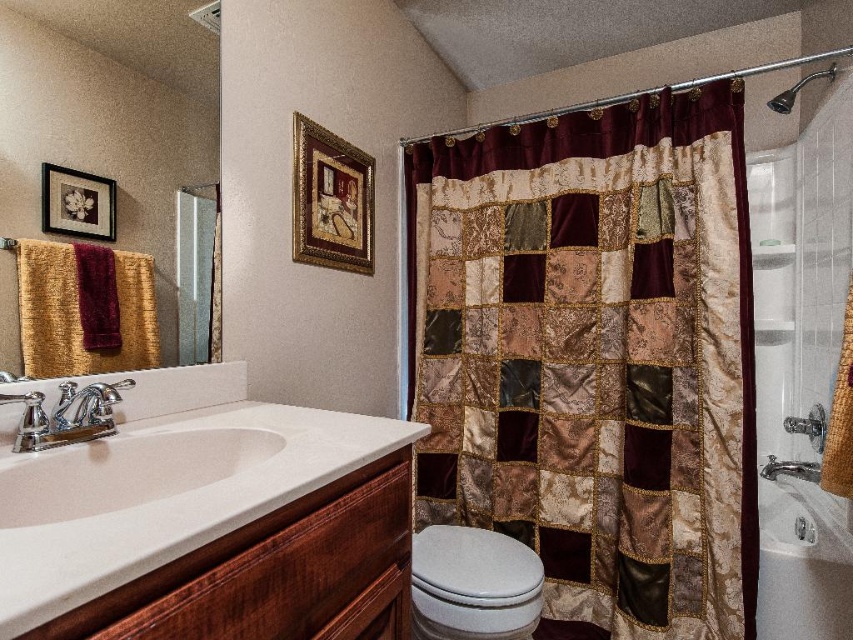
Question: Which object appears closest to the camera in this image?

Choices:
 (A) white ceramic bathtub at lower right
 (B) gold textured towel at left
 (C) white glossy sink at center
 (D) patchwork fabric shower curtain at center

Answer: (C)

Question: Does white ceramic bathtub at lower right appear on the left side of woven straw towel at right?

Choices:
 (A) no
 (B) yes

Answer: (A)

Question: Which point is farther to the camera?

Choices:
 (A) (183, 209)
 (B) (73, 396)
 (C) (183, 445)

Answer: (A)

Question: Can you confirm if white ceramic bathtub at lower right is smaller than metallic silver showerhead at upper right?

Choices:
 (A) yes
 (B) no

Answer: (B)

Question: Which object appears farthest from the camera in this image?

Choices:
 (A) white ceramic bathtub at lower right
 (B) clear glass screen door at left
 (C) gold textured towel at left
 (D) patchwork fabric shower curtain at center

Answer: (D)

Question: Is woven straw towel at right behind chrome metallic faucet at sink left?

Choices:
 (A) no
 (B) yes

Answer: (B)